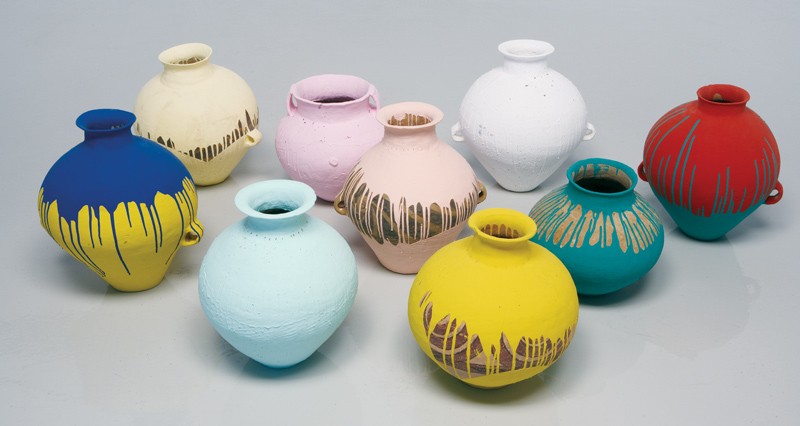
This screenshot has width=800, height=426. Identify the location of vase. (422, 179).